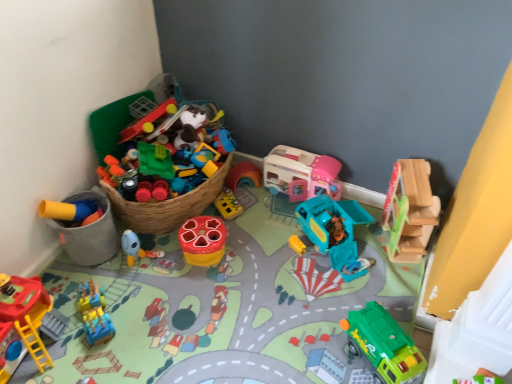
Find the location of a particular element. The height and width of the screenshot is (384, 512). vacant area that lies in front of wooden slide at upper right, which is counted as the 8th toy, starting from the left is located at coordinates (394, 282).